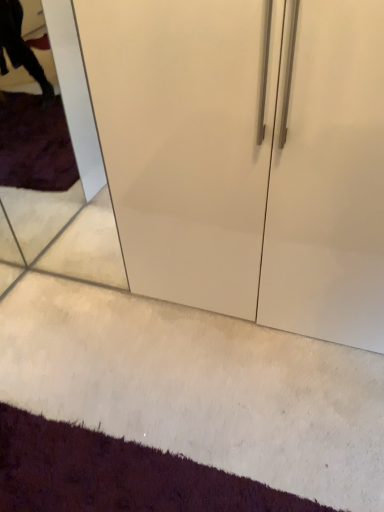
Question: Considering the positions of transparent glass door at left and dark purple carpet at lower left in the image, is transparent glass door at left taller or shorter than dark purple carpet at lower left?

Choices:
 (A) short
 (B) tall

Answer: (B)

Question: Is transparent glass door at left wider or thinner than dark purple carpet at lower left?

Choices:
 (A) thin
 (B) wide

Answer: (A)

Question: Is point (46, 168) closer or farther from the camera than point (110, 457)?

Choices:
 (A) farther
 (B) closer

Answer: (A)

Question: Is dark purple carpet at lower left in front of or behind transparent glass door at left in the image?

Choices:
 (A) behind
 (B) front

Answer: (B)

Question: Is dark purple carpet at lower left wider or thinner than transparent glass door at left?

Choices:
 (A) thin
 (B) wide

Answer: (B)

Question: From the image's perspective, is dark purple carpet at lower left above or below transparent glass door at left?

Choices:
 (A) above
 (B) below

Answer: (B)

Question: Visually, is dark purple carpet at lower left positioned to the left or to the right of transparent glass door at left?

Choices:
 (A) left
 (B) right

Answer: (B)